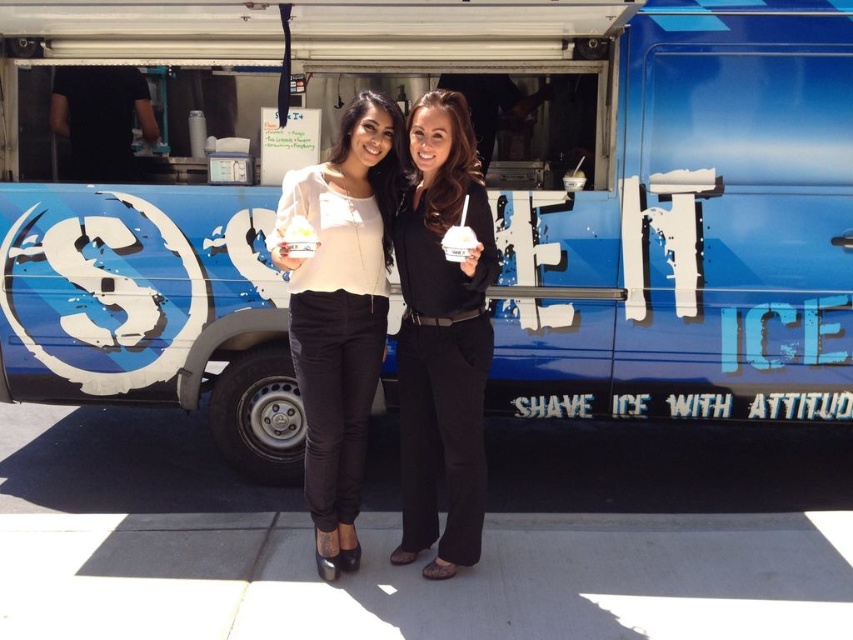
You are a photographer trying to capture a closeup of the white matte ice cream cone at center. You notice the black matte pants at center might block the view. Can you determine if the pants are wider than the cone?

The black matte pants at center might be wider than the white matte ice cream cone at center, so there is a possibility that the pants could block the view of the cone.

You are standing in front of the SWEET ICE food truck and want to take a photo of the point at coordinates point (363, 284). If your camera has a maximum focus range of 3 meters, will it be able to focus on that point?

The point (363, 284) is 3.22 meters from the camera, which exceeds the camera maximum focus range of 3 meters, so the camera cannot focus on that point.

You are a fashion designer observing two women in an image. The first woman is wearing black matte pants at center and a matte white blouse at center. Which clothing item is positioned lower on her body?

The black matte pants at center are located below the matte white blouse at center, so the black matte pants at center are positioned lower on her body.